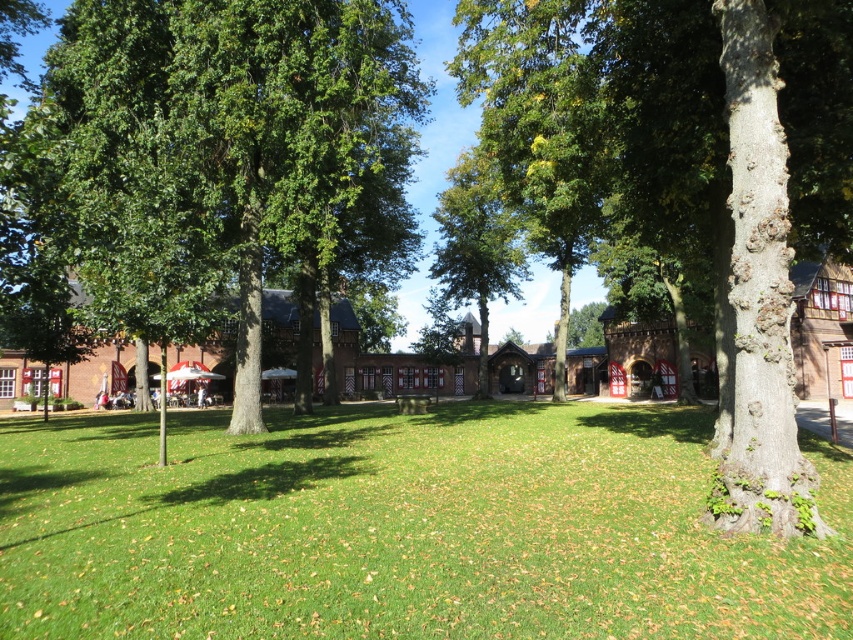
You are standing in the middle of the grassy area and want to hide behind a tree to avoid the sun. Which tree should you choose between the green leafy tree at left and the green leafy tree at center?

You should choose the green leafy tree at center because it is larger than the green leafy tree at left, providing more shade.

You are standing in the middle of the green grass at center and looking towards the green leafy tree at center. Which object is taller from your perspective?

The green leafy tree at center is taller than the green grass at center.